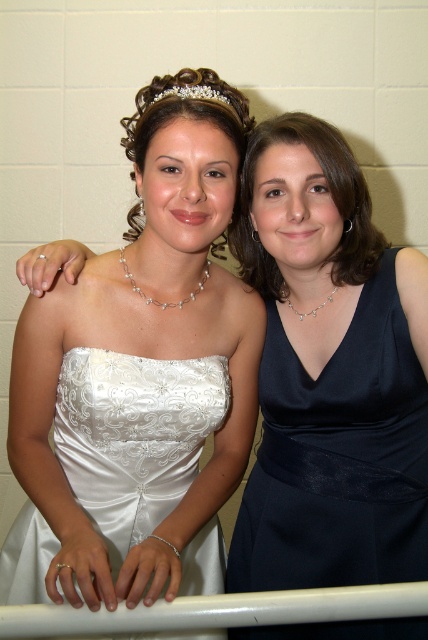
Which is more to the right, satin white dress at center or white plastic rail at lower center?

From the viewer's perspective, white plastic rail at lower center appears more on the right side.

Is satin white dress at center positioned before white plastic rail at lower center?

No, satin white dress at center is behind white plastic rail at lower center.

Who is more distant from viewer, [169,502] or [124,609]?

The point [169,502] is more distant.

Find the location of `satin white dress at center`. satin white dress at center is located at coordinates (137, 387).

In the scene shown: Is navy satin dress at right shorter than white satin dress at center?

Incorrect, navy satin dress at right's height does not fall short of white satin dress at center's.

Is point (407, 413) farther from camera compared to point (38, 518)?

Yes, it is behind point (38, 518).

At what (x,y) coordinates should I click in order to perform the action: click on navy satin dress at right. Please return your answer as a coordinate pair (x, y). This screenshot has height=640, width=428. Looking at the image, I should click on (338, 458).

Is point (234, 122) less distant than point (202, 70)?

Yes, it is.

Between point (139, 568) and point (229, 97), which one is positioned behind?

Positioned behind is point (229, 97).

Is point (207, 200) behind point (195, 92)?

Yes, point (207, 200) is farther from viewer.

I want to click on satin white dress at center, so click(x=137, y=387).